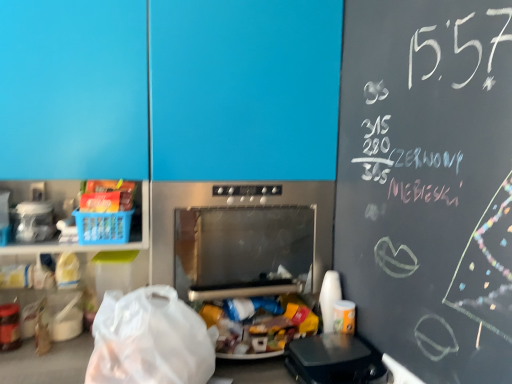
Question: Does transparent plastic grocery bag at lower left contain black plastic waffle maker at lower right, placed as the third appliance when sorted from left to right?

Choices:
 (A) yes
 (B) no

Answer: (B)

Question: Is transparent plastic grocery bag at lower left at the right side of black plastic waffle maker at lower right, placed as the third appliance when sorted from left to right?

Choices:
 (A) yes
 (B) no

Answer: (B)

Question: Can you confirm if transparent plastic grocery bag at lower left is shorter than black plastic waffle maker at lower right, placed as the third appliance when sorted from left to right?

Choices:
 (A) no
 (B) yes

Answer: (A)

Question: From the image's perspective, is transparent plastic grocery bag at lower left under black plastic waffle maker at lower right, arranged as the 3th appliance when viewed from the top?

Choices:
 (A) yes
 (B) no

Answer: (B)

Question: Is the position of transparent plastic grocery bag at lower left more distant than that of black plastic waffle maker at lower right, the first appliance in the right-to-left sequence?

Choices:
 (A) yes
 (B) no

Answer: (B)

Question: In terms of width, does metallic oven at center look wider or thinner when compared to stainless steel microwave at center, positioned as the second appliance in bottom-to-top order?

Choices:
 (A) wide
 (B) thin

Answer: (B)

Question: Is point (93, 112) closer or farther from the camera than point (215, 296)?

Choices:
 (A) farther
 (B) closer

Answer: (B)

Question: Is metallic oven at center in front of or behind stainless steel microwave at center, positioned as the 2th appliance in top-to-bottom order, in the image?

Choices:
 (A) behind
 (B) front

Answer: (B)

Question: Is metallic oven at center inside the boundaries of stainless steel microwave at center, arranged as the 2th appliance when viewed from the right, or outside?

Choices:
 (A) inside
 (B) outside

Answer: (B)

Question: From the image's perspective, is stainless steel microwave at center, positioned as the 2th appliance in top-to-bottom order, located above or below transparent plastic grocery bag at lower left?

Choices:
 (A) below
 (B) above

Answer: (B)

Question: Is stainless steel microwave at center, arranged as the 2th appliance when viewed from the right, spatially inside transparent plastic grocery bag at lower left, or outside of it?

Choices:
 (A) inside
 (B) outside

Answer: (B)

Question: Based on their positions, is stainless steel microwave at center, arranged as the 2th appliance when viewed from the right, located to the left or right of transparent plastic grocery bag at lower left?

Choices:
 (A) left
 (B) right

Answer: (B)

Question: Is point (265, 291) positioned closer to the camera than point (173, 304)?

Choices:
 (A) farther
 (B) closer

Answer: (A)

Question: Do you think stainless steel microwave at center, positioned as the 2th appliance in top-to-bottom order, is within clear plastic container at left, acting as the 1th appliance starting from the left, or outside of it?

Choices:
 (A) inside
 (B) outside

Answer: (B)

Question: Considering the positions of stainless steel microwave at center, which appears as the 2th appliance when viewed from the left, and clear plastic container at left, the 3th appliance when ordered from bottom to top, in the image, is stainless steel microwave at center, which appears as the 2th appliance when viewed from the left, bigger or smaller than clear plastic container at left, the 3th appliance when ordered from bottom to top,?

Choices:
 (A) big
 (B) small

Answer: (A)